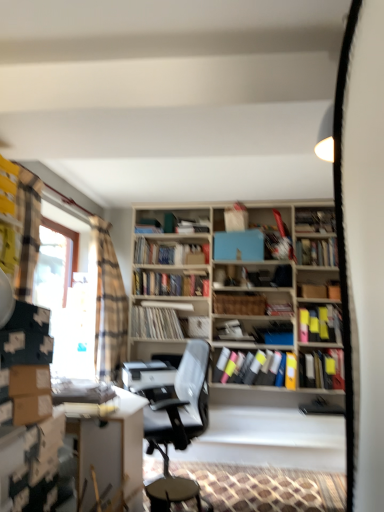
Describe the element at coordinates (320, 324) in the screenshot. The height and width of the screenshot is (512, 384). I see `yellow matte sticky notes at right, which is counted as the sixth book, starting from the top` at that location.

Find the location of a particular element. The image size is (384, 512). yellow matte sticky notes at right, placed as the 5th book when sorted from bottom to top is located at coordinates (320, 324).

This screenshot has height=512, width=384. I want to click on white glossy table at lower left, so click(x=109, y=449).

Based on the photo, measure the distance between wooden crate at center, the 7th book ordered from the bottom, and camera.

They are 13.54 feet apart.

I want to click on clear glass window at left, so click(67, 305).

What is the approximate width of matte black vinyl records at center, which is the 4th book in bottom-to-top order?

The width of matte black vinyl records at center, which is the 4th book in bottom-to-top order, is 9.95 inches.

What is the approximate width of gray fabric office chair at center?

The width of gray fabric office chair at center is 57.18 centimeters.

The image size is (384, 512). Identify the location of yellow matte sticky notes at right, which is counted as the sixth book, starting from the top. (320, 324).

What's the angular difference between matte black book at center, marked as the first book in a bottom-to-top arrangement, and white glossy table at lower left's facing directions?

84.9 degrees separate the facing orientations of matte black book at center, marked as the first book in a bottom-to-top arrangement, and white glossy table at lower left.

Which point is more forward, (341, 409) or (72, 435)?

The point (72, 435) is in front.

Who is shorter, matte black book at center, arranged as the tenth book when viewed from the top, or white glossy table at lower left?

With less height is matte black book at center, arranged as the tenth book when viewed from the top.

Is matte black book at center, arranged as the tenth book when viewed from the top, bigger or smaller than white glossy table at lower left?

In the image, matte black book at center, arranged as the tenth book when viewed from the top, appears to be smaller than white glossy table at lower left.

From a real-world perspective, does matte black vinyl records at center, which is the 4th book in bottom-to-top order, sit lower than hardcover book at center, arranged as the 9th book when ordered from the bottom?

Yes, from a real-world perspective, matte black vinyl records at center, which is the 4th book in bottom-to-top order, is under hardcover book at center, arranged as the 9th book when ordered from the bottom.

From the image's perspective, is matte black vinyl records at center, which is the 4th book in bottom-to-top order, over hardcover book at center, the 2th book when ordered from top to bottom?

Incorrect, from the image's perspective, matte black vinyl records at center, which is the 4th book in bottom-to-top order, is lower than hardcover book at center, the 2th book when ordered from top to bottom.

Which is in front, point (146, 317) or point (332, 240)?

Positioned in front is point (332, 240).

Considering the relative positions of matte black vinyl records at center, which is the 4th book in bottom-to-top order, and hardcover book at center, the 2th book when ordered from top to bottom, in the image provided, is matte black vinyl records at center, which is the 4th book in bottom-to-top order, to the left of hardcover book at center, the 2th book when ordered from top to bottom, from the viewer's perspective?

Yes.

This screenshot has width=384, height=512. Find the location of `table that is in front of the hardcover book at center, arranged as the 9th book when ordered from the bottom`. table that is in front of the hardcover book at center, arranged as the 9th book when ordered from the bottom is located at coordinates (109, 449).

From the image's perspective, which is below, white glossy table at lower left or hardcover book at center, arranged as the 9th book when ordered from the bottom?

white glossy table at lower left is shown below in the image.

Would you consider white glossy table at lower left to be distant from hardcover book at center, arranged as the 9th book when ordered from the bottom?

Yes, white glossy table at lower left and hardcover book at center, arranged as the 9th book when ordered from the bottom, are located far from each other.

Which of these two, white glossy table at lower left or hardcover book at center, arranged as the 9th book when ordered from the bottom, is thinner?

With smaller width is hardcover book at center, arranged as the 9th book when ordered from the bottom.

Is white glossy table at lower left aimed at gray fabric office chair at center?

Yes, white glossy table at lower left is oriented towards gray fabric office chair at center.

From the image's perspective, between white glossy table at lower left and gray fabric office chair at center, which one is located above?

gray fabric office chair at center is shown above in the image.

Based on the photo, is white glossy table at lower left situated inside gray fabric office chair at center or outside?

white glossy table at lower left is not inside gray fabric office chair at center, it's outside.

Which object is closer to the camera, white glossy table at lower left or gray fabric office chair at center?

white glossy table at lower left is closer to the camera.

Can you confirm if hardcover book at center, the 2th book when ordered from top to bottom, is bigger than wooden crate at center, which is the fourth book from top to bottom?

Actually, hardcover book at center, the 2th book when ordered from top to bottom, might be smaller than wooden crate at center, which is the fourth book from top to bottom.

Consider the image. Who is shorter, hardcover book at center, arranged as the 9th book when ordered from the bottom, or wooden crate at center, which is the fourth book from top to bottom?

wooden crate at center, which is the fourth book from top to bottom.

Which point is more forward, (296, 244) or (257, 312)?

The point (257, 312) is in front.

From a real-world perspective, which book is the 6th one underneath the blue matte paperback book at center? Please provide its 2D coordinates.

[(320, 324)]

Is the depth of yellow matte sticky notes at right, placed as the 5th book when sorted from bottom to top, greater than that of blue matte paperback book at center?

No, the depth of yellow matte sticky notes at right, placed as the 5th book when sorted from bottom to top, is less than that of blue matte paperback book at center.

Between yellow matte sticky notes at right, placed as the 5th book when sorted from bottom to top, and blue matte paperback book at center, which one has larger width?

yellow matte sticky notes at right, placed as the 5th book when sorted from bottom to top.

Does yellow matte sticky notes at right, which is counted as the sixth book, starting from the top, contain blue matte paperback book at center?

No, yellow matte sticky notes at right, which is counted as the sixth book, starting from the top, does not contain blue matte paperback book at center.

Is white glossy table at lower left wider than clear glass window at left?

Yes.

You are a GUI agent. You are given a task and a screenshot of the screen. Output one action in this format:
    pyautogui.click(x=<x>, y=<y>)
    Task: Click on the window screen located above the white glossy table at lower left (from the image's perspective)
    The width and height of the screenshot is (384, 512).
    Given the screenshot: What is the action you would take?
    pyautogui.click(x=67, y=305)

How different are the orientations of white glossy table at lower left and clear glass window at left in degrees?

2.37 degrees.

From a real-world perspective, which is physically below, white glossy table at lower left or clear glass window at left?

white glossy table at lower left.

I want to click on table in front of the matte black book at center, arranged as the tenth book when viewed from the top, so click(109, 449).

From the matte black vinyl records at center, the 7th book in the top-to-bottom sequence, count 9th book to the right and point to it. Please provide its 2D coordinates.

[(317, 252)]

Estimate the real-world distances between objects in this image. Which object is further from matte black vinyl records at center, the 7th book in the top-to-bottom sequence, hardcover books at center, marked as the first book in a top-to-bottom arrangement, or matte black book at center, which is counted as the 5th book, starting from the top?

matte black book at center, which is counted as the 5th book, starting from the top.

Estimate the real-world distances between objects in this image. Which object is further from hardcover book at center, arranged as the 9th book when ordered from the bottom, matte black book at right, which ranks as the third book in bottom-to-top order, or matte black book at center, marked as the first book in a bottom-to-top arrangement?

matte black book at center, marked as the first book in a bottom-to-top arrangement, lies further to hardcover book at center, arranged as the 9th book when ordered from the bottom, than the other object.

Estimate the real-world distances between objects in this image. Which object is closer to matte black book at right, which ranks as the third book in bottom-to-top order, yellow matte sticky notes at right, placed as the 5th book when sorted from bottom to top, or clear glass window at left?

yellow matte sticky notes at right, placed as the 5th book when sorted from bottom to top.

Consider the image. When comparing their distances from matte black book at right, arranged as the 8th book when viewed from the top, does clear glass window at left or plaid fabric curtain at left seem closer?

plaid fabric curtain at left.

Which object lies nearer to the anchor point hardcover book at center, arranged as the 9th book when ordered from the bottom, blue matte paperback book at center or matte black vinyl records at center, the 7th book in the top-to-bottom sequence?

blue matte paperback book at center is positioned closer to the anchor hardcover book at center, arranged as the 9th book when ordered from the bottom.

When comparing their distances from hardcover book at center, arranged as the 9th book when ordered from the bottom, does wooden bar stool at center or yellow matte sticky notes at right, placed as the 5th book when sorted from bottom to top, seem further?

wooden bar stool at center lies further to hardcover book at center, arranged as the 9th book when ordered from the bottom, than the other object.

Looking at the image, which one is located closer to matte black vinyl records at center, which is the 4th book in bottom-to-top order, matte black book at right, which ranks as the third book in bottom-to-top order, or white glossy table at lower left?

Based on the image, matte black book at right, which ranks as the third book in bottom-to-top order, appears to be nearer to matte black vinyl records at center, which is the 4th book in bottom-to-top order.

Estimate the real-world distances between objects in this image. Which object is further from hardcover book at center, the 2th book when ordered from top to bottom, hardcover books at center, which appears as the tenth book when ordered from the bottom, or blue matte paperback book at center?

hardcover books at center, which appears as the tenth book when ordered from the bottom.

In order to click on book positioned between gray fabric office chair at center and matte black book at right, arranged as the 8th book when viewed from the top, from near to far in this screenshot , I will do (321, 407).

The image size is (384, 512). I want to click on table between wooden bar stool at center and matte plastic books at center, which is counted as the ninth book, starting from the top, in the front-back direction, so click(109, 449).

Locate an element on the screen. The image size is (384, 512). chair between wooden bar stool at center and hardcover books at center, positioned as the 3th book in top-to-bottom order, in the front-back direction is located at coordinates (178, 403).

At what (x,y) coordinates should I click in order to perform the action: click on chair between clear glass window at left and matte black book at center, marked as the 6th book in a bottom-to-top arrangement, from left to right. Please return your answer as a coordinate pair (x, y). The width and height of the screenshot is (384, 512). Looking at the image, I should click on coord(178,403).